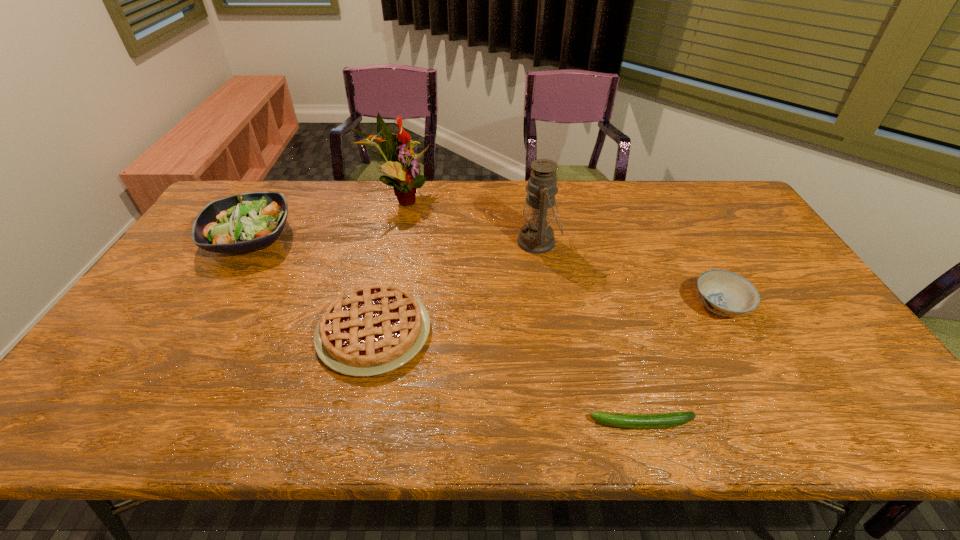
I want to click on bouquet, so click(x=407, y=178).

This screenshot has height=540, width=960. I want to click on oil lamp, so click(x=537, y=237).

Locate an element on the screen. the leftmost object is located at coordinates (243, 222).

This screenshot has width=960, height=540. Find the location of `salad plate`. salad plate is located at coordinates (243, 222).

Where is `bowl`? The image size is (960, 540). bowl is located at coordinates (724, 293).

At what (x,y) coordinates should I click in order to perform the action: click on pie. Please return your answer as a coordinate pair (x, y). The height and width of the screenshot is (540, 960). Looking at the image, I should click on (374, 329).

The height and width of the screenshot is (540, 960). In order to click on zucchini in this screenshot , I will do `click(635, 421)`.

Where is `the shortest object`? the shortest object is located at coordinates 635,421.

Image resolution: width=960 pixels, height=540 pixels. What are the coordinates of `free space located on the front-facing side of the bouquet` in the screenshot? It's located at (527, 199).

Locate an element on the screen. This screenshot has width=960, height=540. free location located 0.190m on the front of the oil lamp is located at coordinates (548, 307).